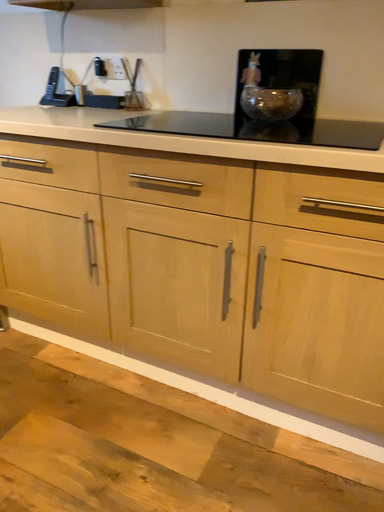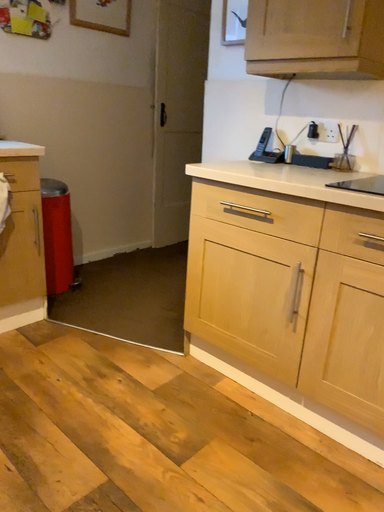
Question: Which way did the camera rotate in the video?

Choices:
 (A) rotated upward
 (B) rotated downward

Answer: (A)